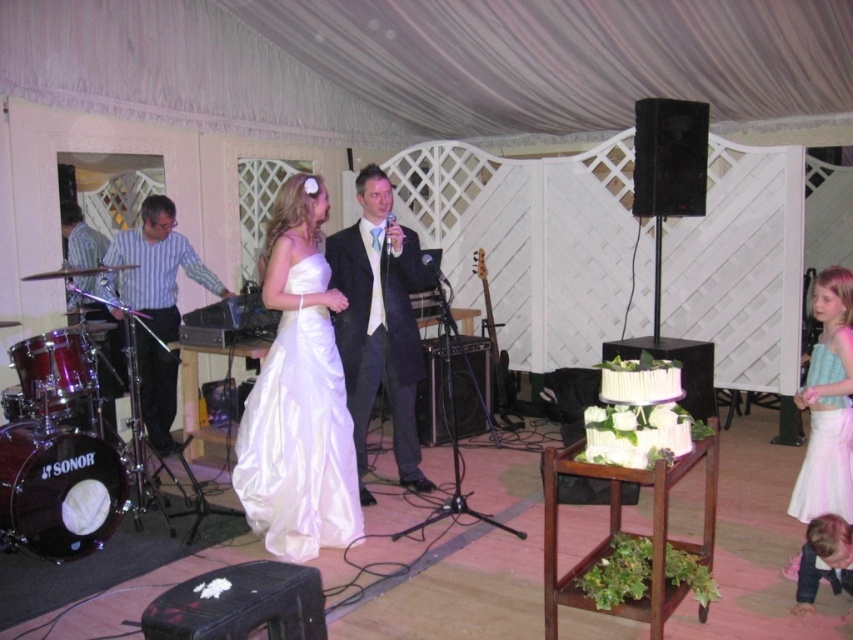
Question: Can you confirm if striped fabric shirt at left is wider than shiny silver drum set at left?

Choices:
 (A) no
 (B) yes

Answer: (B)

Question: Which object is farther from the camera taking this photo?

Choices:
 (A) satin white dress at center
 (B) white satin dress at right
 (C) shiny silver drum set at left

Answer: (C)

Question: Can you confirm if matte black suit at center is positioned below white satin dress at right?

Choices:
 (A) no
 (B) yes

Answer: (A)

Question: Can you confirm if satin white dress at center is positioned to the left of white fondant cake at center?

Choices:
 (A) no
 (B) yes

Answer: (B)

Question: Among these objects, which one is farthest from the camera?

Choices:
 (A) white satin dress at center
 (B) white satin dress at right
 (C) striped fabric shirt at left

Answer: (C)

Question: Which object appears farthest from the camera in this image?

Choices:
 (A) shiny silver drum set at left
 (B) matte black suit at center
 (C) white satin dress at center

Answer: (A)